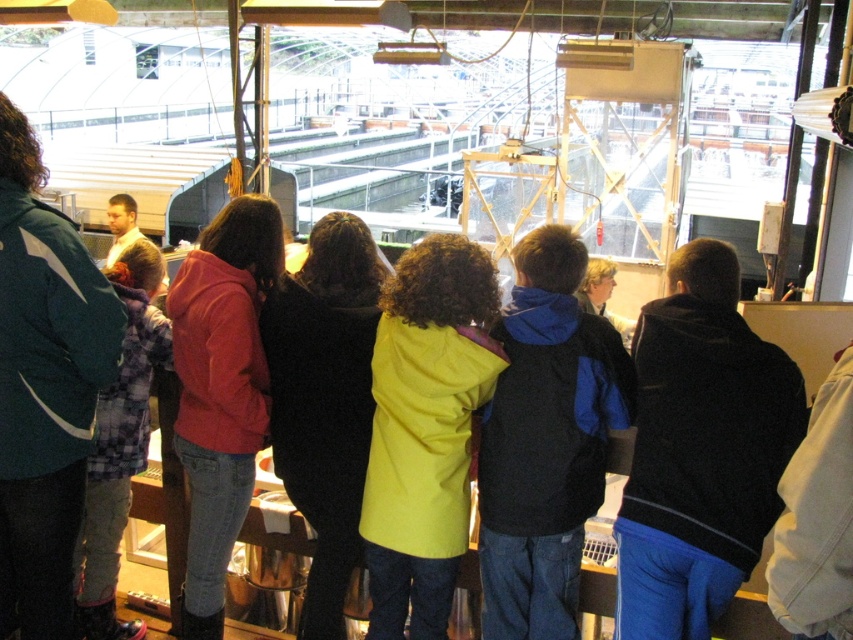
Question: Is black fleece jacket at center positioned behind yellow matte coat at center?

Choices:
 (A) yes
 (B) no

Answer: (B)

Question: Which point is farther to the camera?

Choices:
 (A) (537, 333)
 (B) (230, 516)
 (C) (376, 456)

Answer: (B)

Question: Among these points, which one is nearest to the camera?

Choices:
 (A) (698, 282)
 (B) (525, 566)
 (C) (465, 339)
 (D) (177, 344)

Answer: (A)

Question: Observing the image, what is the correct spatial positioning of black fleece jacket at center in reference to matte red jacket at center?

Choices:
 (A) left
 (B) right

Answer: (B)

Question: Among these objects, which one is nearest to the camera?

Choices:
 (A) matte red jacket at center
 (B) black fleece jacket at center
 (C) blue fleece jacket at center

Answer: (B)

Question: Is blue fleece jacket at center smaller than matte red jacket at center?

Choices:
 (A) yes
 (B) no

Answer: (A)